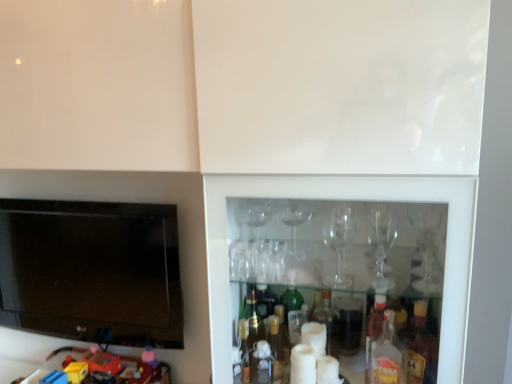
Question: From the image's perspective, is plastic toy car at lower left positioned above or below black glossy flat-screen tv at left?

Choices:
 (A) below
 (B) above

Answer: (A)

Question: Would you say plastic toy car at lower left is inside or outside black glossy flat-screen tv at left?

Choices:
 (A) inside
 (B) outside

Answer: (B)

Question: In the image, is plastic toy car at lower left positioned in front of or behind black glossy flat-screen tv at left?

Choices:
 (A) front
 (B) behind

Answer: (A)

Question: Is black glossy flat-screen tv at left wider or thinner than plastic toy car at lower left?

Choices:
 (A) wide
 (B) thin

Answer: (B)

Question: From the image's perspective, is black glossy flat-screen tv at left above or below plastic toy car at lower left?

Choices:
 (A) above
 (B) below

Answer: (A)

Question: From a real-world perspective, is black glossy flat-screen tv at left above or below plastic toy car at lower left?

Choices:
 (A) above
 (B) below

Answer: (A)

Question: Based on their positions, is black glossy flat-screen tv at left located to the left or right of plastic toy car at lower left?

Choices:
 (A) right
 (B) left

Answer: (B)